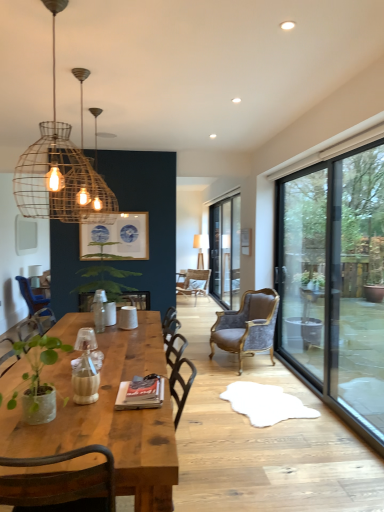
Find the location of `wooden table at center`. wooden table at center is located at coordinates (110, 418).

Locate an element on the screen. This screenshot has width=384, height=512. white matte cup at center is located at coordinates (128, 318).

Measure the distance between point (x=54, y=407) and camera.

The distance of point (x=54, y=407) from camera is 1.94 meters.

What do you see at coordinates (225, 251) in the screenshot?
I see `transparent glass door at center` at bounding box center [225, 251].

Find the location of a particular element. wooden table at center is located at coordinates (110, 418).

Is wooden table at center at the right side of transparent glass window at right?

In fact, wooden table at center is to the left of transparent glass window at right.

Is the position of wooden table at center more distant than that of transparent glass window at right?

No, it is not.

Can transparent glass window at right be found inside wooden table at center?

No, transparent glass window at right is located outside of wooden table at center.

Which object is further away from the camera, transparent glass door at center or blue paper picture frame at upper center?

Positioned behind is transparent glass door at center.

Is transparent glass door at center wider than blue paper picture frame at upper center?

Yes, transparent glass door at center is wider than blue paper picture frame at upper center.

Considering the points (220, 244) and (133, 230), which point is in front, point (220, 244) or point (133, 230)?

The point (133, 230) is closer.

From the image's perspective, which object appears higher, rustic wire pendant light at upper left or white matte cup at center?

From the image's view, rustic wire pendant light at upper left is above.

Is rustic wire pendant light at upper left taller or shorter than white matte cup at center?

Considering their sizes, rustic wire pendant light at upper left has more height than white matte cup at center.

Can you confirm if rustic wire pendant light at upper left is positioned to the left of white matte cup at center?

Yes.

Locate an element on the screen. Image resolution: width=384 pixels, height=512 pixels. chair located on the left of rustic wire pendant light at upper left is located at coordinates (31, 296).

Is point (27, 292) closer or farther from the camera than point (72, 145)?

Point (27, 292) appears to be closer to the viewer than point (72, 145).

From the image's perspective, between blue fabric chair at left, the 2th chair in the back-to-front sequence, and rustic wire pendant light at upper left, which one is located above?

rustic wire pendant light at upper left.

Is velvet brown armchair at center, the 2th chair in the right-to-left sequence, next to blue paper picture frame at upper center and touching it?

No, velvet brown armchair at center, the 2th chair in the right-to-left sequence, is not in contact with blue paper picture frame at upper center.

From the image's perspective, is velvet brown armchair at center, the second chair in the left-to-right sequence, over blue paper picture frame at upper center?

Actually, velvet brown armchair at center, the second chair in the left-to-right sequence, appears below blue paper picture frame at upper center in the image.

From a real-world perspective, is velvet brown armchair at center, the second chair in the left-to-right sequence, above or below blue paper picture frame at upper center?

velvet brown armchair at center, the second chair in the left-to-right sequence, is below blue paper picture frame at upper center.

Which point is more forward, (x=203, y=270) or (x=31, y=307)?

The point (x=31, y=307) is in front.

Is velvet brown armchair at center, the second chair in the left-to-right sequence, inside the boundaries of blue fabric chair at left, positioned as the 1th chair in left-to-right order, or outside?

velvet brown armchair at center, the second chair in the left-to-right sequence, exists outside the volume of blue fabric chair at left, positioned as the 1th chair in left-to-right order.

Is velvet brown armchair at center, the second chair in the left-to-right sequence, looking in the opposite direction of blue fabric chair at left, the 2th chair in the back-to-front sequence?

velvet brown armchair at center, the second chair in the left-to-right sequence, is not turned away from blue fabric chair at left, the 2th chair in the back-to-front sequence.

Can you tell me how much white matte cup at center and velvet brown armchair at center, marked as the third chair in a back-to-front arrangement, differ in facing direction?

white matte cup at center and velvet brown armchair at center, marked as the third chair in a back-to-front arrangement, are facing 72.6 degrees away from each other.

From the image's perspective, does white matte cup at center appear lower than velvet brown armchair at center, the first chair from the front?

Incorrect, from the image's perspective, white matte cup at center is higher than velvet brown armchair at center, the first chair from the front.

Based on their positions, is white matte cup at center located to the left or right of velvet brown armchair at center, the first chair from the right?

Based on their positions, white matte cup at center is located to the left of velvet brown armchair at center, the first chair from the right.

Does white matte cup at center come behind velvet brown armchair at center, the first chair from the right?

No, the depth of white matte cup at center is less than that of velvet brown armchair at center, the first chair from the right.

Image resolution: width=384 pixels, height=512 pixels. There is a wooden table at center. Identify the location of window screen above it (from a real-world perspective). (358, 287).

I want to click on picture frame lying above the transparent glass door at center (from the image's perspective), so click(x=116, y=239).

Considering their positions, is blue paper picture frame at upper center positioned further to blue fabric chair at left, which is the second chair in front-to-back order, than transparent glass door at center?

Among the two, transparent glass door at center is located further to blue fabric chair at left, which is the second chair in front-to-back order.

Based on their spatial positions, is green matte plant at lower left, which is the second houseplant from back to front, or blue paper picture frame at upper center closer to white matte cup at center?

Based on the image, blue paper picture frame at upper center appears to be nearer to white matte cup at center.

From the image, which object appears to be farther from green matte plant at lower left, the first houseplant from the front, blue fabric chair at left, the 2th chair in the back-to-front sequence, or white matte cup at center?

blue fabric chair at left, the 2th chair in the back-to-front sequence, is positioned further to the anchor green matte plant at lower left, the first houseplant from the front.

In the scene shown: When comparing their distances from blue fabric chair at left, which is the second chair in front-to-back order, does velvet brown armchair at center, the first chair from the front, or blue paper picture frame at upper center seem further?

The object further to blue fabric chair at left, which is the second chair in front-to-back order, is velvet brown armchair at center, the first chair from the front.

From the image, which object appears to be nearer to blue fabric chair at left, the 2th chair in the back-to-front sequence, velvet brown armchair at center, the first chair from the right, or green leafy plant at center, the 1th houseplant from the back?

Based on the image, green leafy plant at center, the 1th houseplant from the back, appears to be nearer to blue fabric chair at left, the 2th chair in the back-to-front sequence.

Which object lies nearer to the anchor point green leafy plant at center, the 1th houseplant from the back, rustic wire pendant light at upper left or blue fabric chair at left, positioned as the 1th chair in left-to-right order?

Among the two, blue fabric chair at left, positioned as the 1th chair in left-to-right order, is located nearer to green leafy plant at center, the 1th houseplant from the back.

Looking at the image, which one is located further to wooden table at center, white matte cup at center or rustic wire pendant light at upper left?

Among the two, rustic wire pendant light at upper left is located further to wooden table at center.

Considering their positions, is green leafy plant at center, the 1th houseplant from the back, positioned closer to velvet brown armchair at center, the third chair positioned from the left, than blue fabric chair at left, the 2th chair in the back-to-front sequence?

green leafy plant at center, the 1th houseplant from the back, is positioned closer to the anchor velvet brown armchair at center, the third chair positioned from the left.

Identify the location of houseplant between green matte plant at lower left, which is the second houseplant from back to front, and velvet brown armchair at center, which ranks as the 3th chair in front-to-back order, along the z-axis. (106, 276).

Locate an element on the screen. window screen between green matte plant at lower left, the first houseplant from the front, and velvet brown armchair at center, the 2th chair in the right-to-left sequence, from front to back is located at coordinates (358, 287).

Where is `window screen positioned between rustic wire pendant light at upper left and velvet brown armchair at center, which ranks as the 3th chair in front-to-back order, from near to far`? This screenshot has height=512, width=384. window screen positioned between rustic wire pendant light at upper left and velvet brown armchair at center, which ranks as the 3th chair in front-to-back order, from near to far is located at coordinates (358, 287).

Identify the location of tableware situated between green leafy plant at center, the 1th houseplant from the back, and velvet brown armchair at center, the first chair from the front, from left to right. (128, 318).